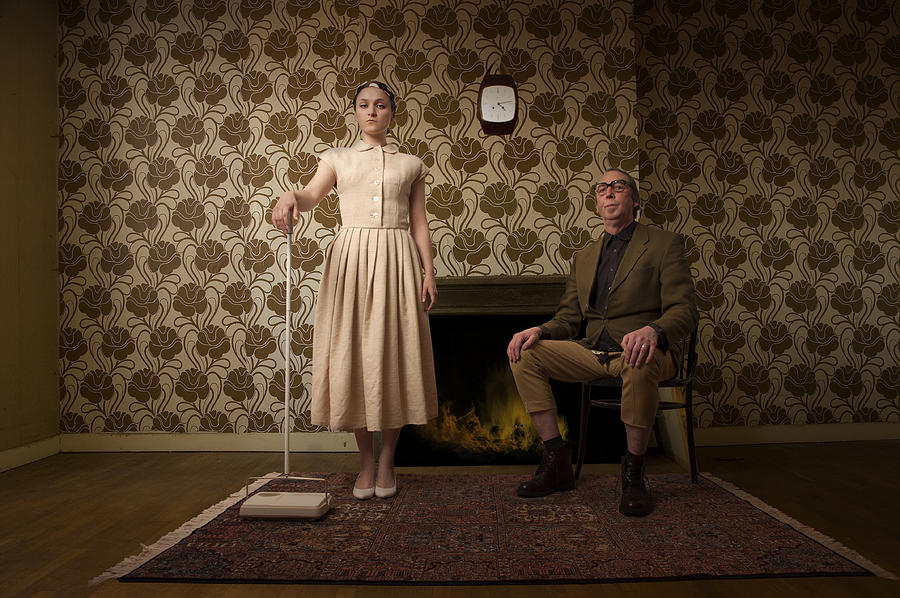
Find the location of a particular element. This screenshot has width=900, height=598. darker side of the room is located at coordinates (745, 57), (859, 486).